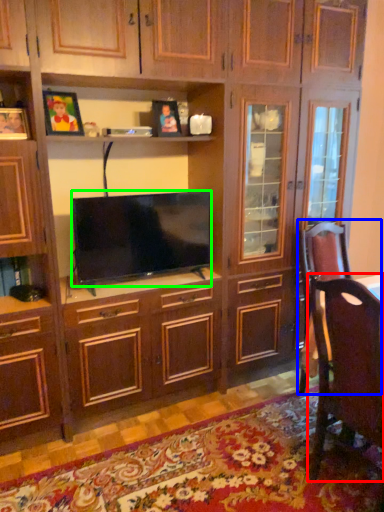
Question: Which object is the farthest from chair (highlighted by a red box)? Choose among these: swivel chair (highlighted by a blue box) or television (highlighted by a green box).

Choices:
 (A) swivel chair
 (B) television

Answer: (B)